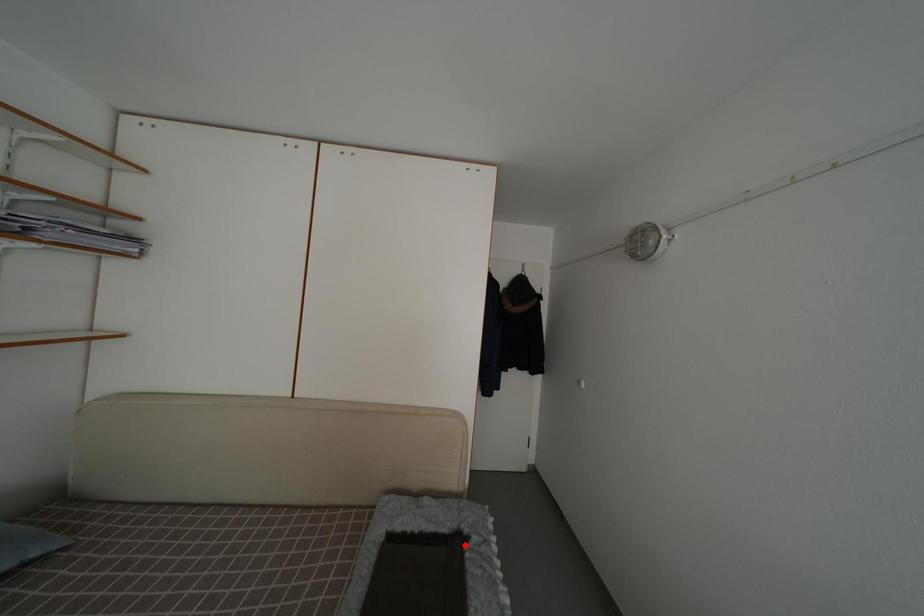
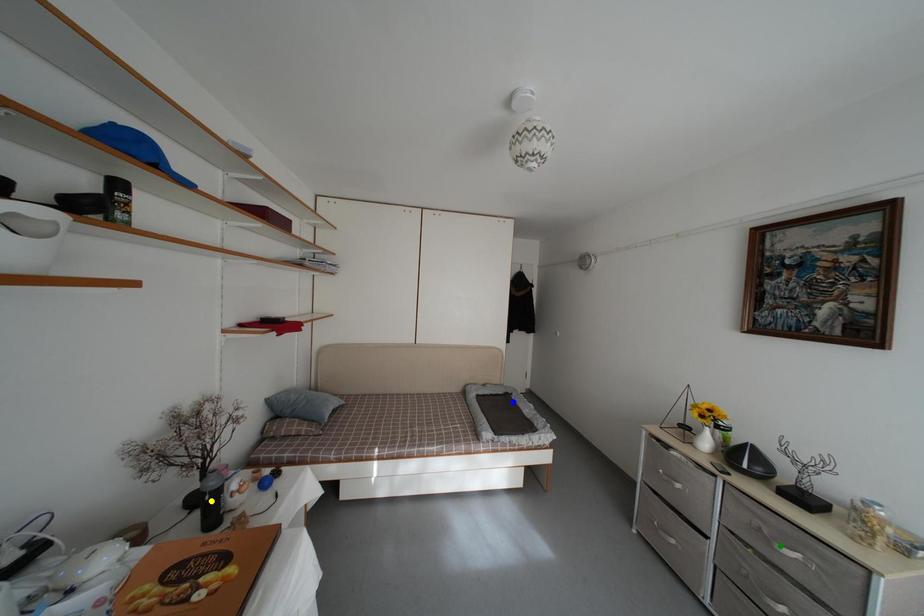
Question: I am providing you with two images of the same scene from different viewpoints. A red point is marked on the first image. You are given multiple points on the second image. Which spot in image 2 lines up with the point in image 1?

Choices:
 (A) blue point
 (B) yellow point
 (C) green point

Answer: (A)